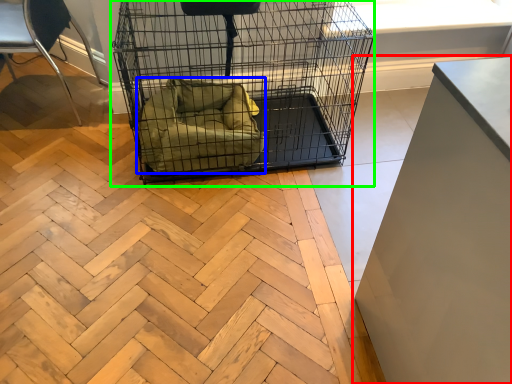
Question: Which object is the closest to the furniture (highlighted by a red box)? Choose among these: dog bed (highlighted by a blue box) or bird cage (highlighted by a green box).

Choices:
 (A) dog bed
 (B) bird cage

Answer: (A)